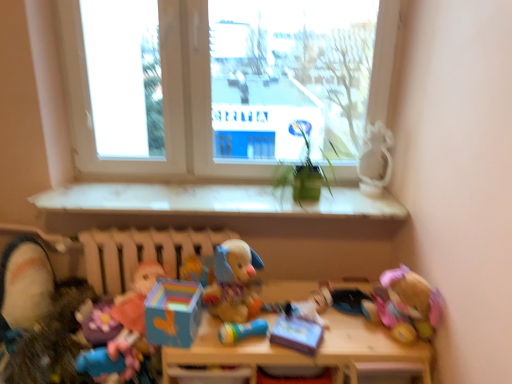
Find the location of a particular element. Image resolution: width=512 pixels, height=384 pixels. free space between rubber duck at center, the seventh toy positioned from the left, and matte cardboard box at center, the eighth toy viewed from the left is located at coordinates (259, 348).